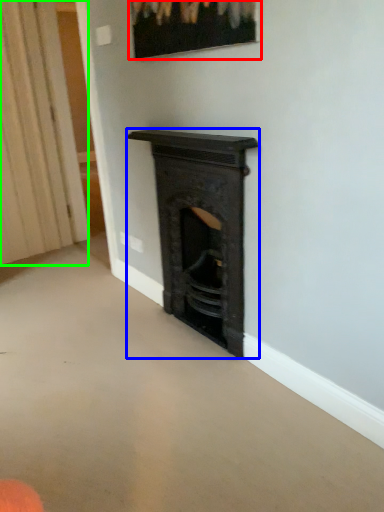
Question: Estimate the real-world distances between objects in this image. Which object is closer to picture frame (highlighted by a red box), fireplace (highlighted by a blue box) or curtain (highlighted by a green box)?

Choices:
 (A) fireplace
 (B) curtain

Answer: (A)